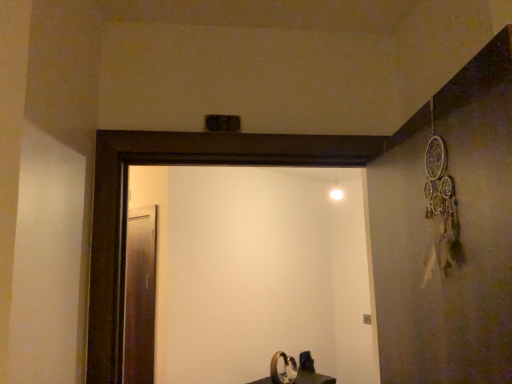
Question: Is point (309, 364) closer or farther from the camera than point (331, 253)?

Choices:
 (A) farther
 (B) closer

Answer: (B)

Question: Considering their positions, is matte black sink at lower center located in front of or behind white glossy screen door at center, which is the second screen door in left-to-right order?

Choices:
 (A) behind
 (B) front

Answer: (A)

Question: Estimate the real-world distances between objects in this image. Which object is farther from the matte black sink at lower center?

Choices:
 (A) white glossy screen door at center, which is the 1th screen door from right to left
 (B) transparent glass screen door at left, positioned as the first screen door in left-to-right order

Answer: (B)

Question: Estimate the real-world distances between objects in this image. Which object is farther from the white glossy screen door at center, which is the 1th screen door from right to left?

Choices:
 (A) transparent glass screen door at left, the second screen door in the right-to-left sequence
 (B) matte black sink at lower center

Answer: (A)